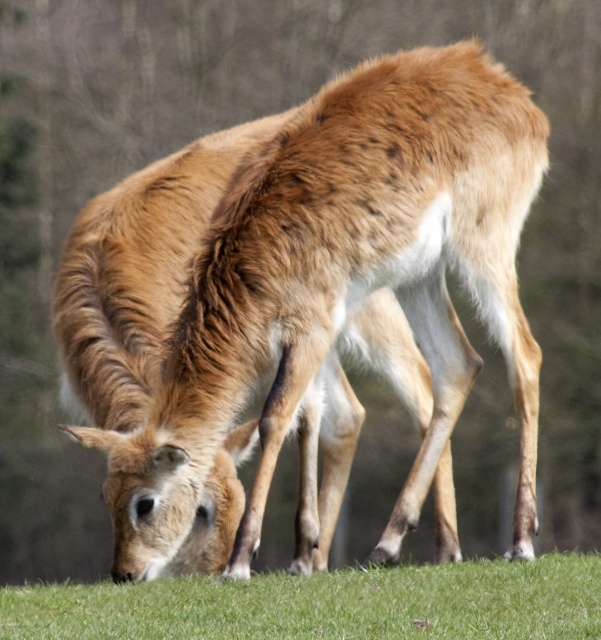
Is point (261, 321) positioned before point (258, 612)?

No, it is behind (258, 612).

Image resolution: width=601 pixels, height=640 pixels. Identify the location of brown fur deer at center. (343, 285).